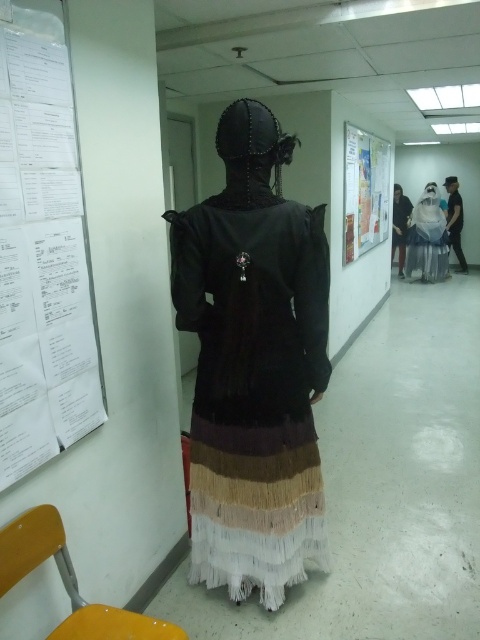
You are an event planner setting up a corridor for a formal event. You have two white papers to place in the hallway. The first is a single white paper at left, and the second is a white paper poster at upper right. According to the scene, how far apart should these two items be placed?

The two items should be placed 4.14 meters apart as the distance between the white paper at left and white paper poster at upper right is 4.14 meters.

You are standing in the hallway and want to pick up the white fabric bag at center. Is the black leather jacket at right blocking your path to it?

The white fabric bag at center is behind the black leather jacket at right, so the jacket is blocking the path to the bag.

You are a fashion designer observing the hallway scene. You need to determine the relative height of the black leather jacket at right and the white fabric bag at center. Which object is shorter?

The black leather jacket at right is shorter than the white fabric bag at center.